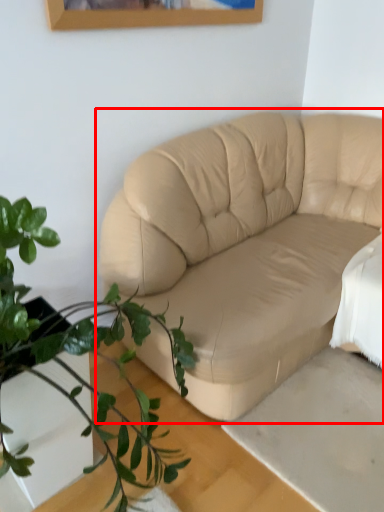
Question: From the image's perspective, where is studio couch (annotated by the red box) located relative to houseplant?

Choices:
 (A) below
 (B) above

Answer: (B)